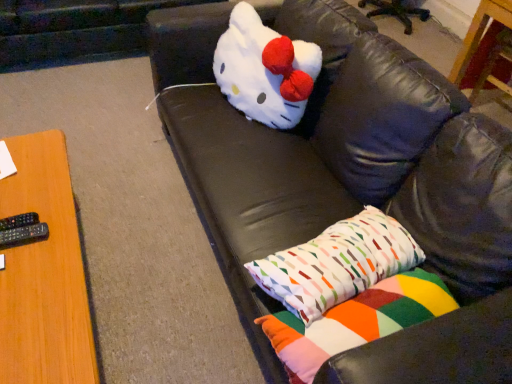
The image size is (512, 384). Identify the location of black plastic remote at left, which is counted as the first remote, starting from the top. pyautogui.click(x=19, y=221).

What do you see at coordinates (480, 33) in the screenshot?
I see `wooden table at upper right, acting as the second table starting from the left` at bounding box center [480, 33].

In order to click on geometric-patterned fabric pillow at lower right, placed as the 2th pillow when sorted from bottom to top in this screenshot , I will do `click(337, 264)`.

The height and width of the screenshot is (384, 512). What do you see at coordinates (265, 70) in the screenshot? I see `white plush toy at center` at bounding box center [265, 70].

The image size is (512, 384). What do you see at coordinates (364, 189) in the screenshot?
I see `black leather couch at upper center` at bounding box center [364, 189].

This screenshot has height=384, width=512. I want to click on wooden table at left, placed as the first table when sorted from left to right, so click(44, 273).

I want to click on black plastic remote at left, the 2th remote positioned from the top, so click(24, 235).

The width and height of the screenshot is (512, 384). Describe the element at coordinates (356, 321) in the screenshot. I see `multicolored fabric pillow at lower right, the second pillow when ordered from top to bottom` at that location.

I want to click on black plastic remote at left, which is counted as the first remote, starting from the top, so click(x=19, y=221).

Would you say geometric-patterned fabric pillow at lower right, which is the 1th pillow in top-to-bottom order, is outside wooden table at left, the 2th table viewed from the right?

That's correct, geometric-patterned fabric pillow at lower right, which is the 1th pillow in top-to-bottom order, is outside of wooden table at left, the 2th table viewed from the right.

From the image's perspective, is geometric-patterned fabric pillow at lower right, placed as the 2th pillow when sorted from bottom to top, positioned above or below wooden table at left, marked as the 1th table in a front-to-back arrangement?

Based on their image positions, geometric-patterned fabric pillow at lower right, placed as the 2th pillow when sorted from bottom to top, is located above wooden table at left, marked as the 1th table in a front-to-back arrangement.

From the picture: How distant is geometric-patterned fabric pillow at lower right, placed as the 2th pillow when sorted from bottom to top, from wooden table at left, placed as the first table when sorted from left to right?

geometric-patterned fabric pillow at lower right, placed as the 2th pillow when sorted from bottom to top, is 27.01 inches away from wooden table at left, placed as the first table when sorted from left to right.

Which is behind, point (403, 263) or point (58, 235)?

Point (58, 235)

Can you confirm if multicolored fabric pillow at lower right, the 1th pillow ordered from the bottom, is bigger than black leather couch at upper center?

Incorrect, multicolored fabric pillow at lower right, the 1th pillow ordered from the bottom, is not larger than black leather couch at upper center.

Is black leather couch at upper center inside multicolored fabric pillow at lower right, the 1th pillow ordered from the bottom?

No, black leather couch at upper center is located outside of multicolored fabric pillow at lower right, the 1th pillow ordered from the bottom.

Which point is more distant from viewer, [271,329] or [182,129]?

The point [182,129] is more distant.

Are multicolored fabric pillow at lower right, the second pillow when ordered from top to bottom, and black leather couch at upper center far apart?

Actually, multicolored fabric pillow at lower right, the second pillow when ordered from top to bottom, and black leather couch at upper center are a little close together.

From the image's perspective, is black plastic remote at left, the second remote positioned from the bottom, beneath black plastic remote at left, the 2th remote positioned from the top?

No, from the image's perspective, black plastic remote at left, the second remote positioned from the bottom, is not beneath black plastic remote at left, the 2th remote positioned from the top.

From a real-world perspective, does black plastic remote at left, which is counted as the first remote, starting from the top, sit lower than black plastic remote at left, placed as the 1th remote when sorted from bottom to top?

Indeed, from a real-world perspective, black plastic remote at left, which is counted as the first remote, starting from the top, is positioned beneath black plastic remote at left, placed as the 1th remote when sorted from bottom to top.

Which object is closer to the camera, black plastic remote at left, the second remote positioned from the bottom, or black plastic remote at left, placed as the 1th remote when sorted from bottom to top?

black plastic remote at left, placed as the 1th remote when sorted from bottom to top, is in front.

Considering the relative positions of black leather couch at upper center and black plastic remote at left, which is counted as the first remote, starting from the top, in the image provided, is black leather couch at upper center in front of black plastic remote at left, which is counted as the first remote, starting from the top,?

Yes, black leather couch at upper center is in front of black plastic remote at left, which is counted as the first remote, starting from the top.

Is black plastic remote at left, the second remote positioned from the bottom, surrounded by black leather couch at upper center?

Definitely not — black plastic remote at left, the second remote positioned from the bottom, is not inside black leather couch at upper center.

From the image's perspective, between black leather couch at upper center and black plastic remote at left, which is counted as the first remote, starting from the top, which one is located above?

black leather couch at upper center, from the image's perspective.

Is black leather couch at upper center next to black plastic remote at left, the second remote positioned from the bottom, and touching it?

No, black leather couch at upper center is not beside black plastic remote at left, the second remote positioned from the bottom.

Considering the points (470, 41) and (370, 324), which point is behind, point (470, 41) or point (370, 324)?

Positioned behind is point (470, 41).

Considering their positions, is wooden table at upper right, which appears as the second table when ordered from the bottom, located in front of or behind multicolored fabric pillow at lower right, the second pillow when ordered from top to bottom?

wooden table at upper right, which appears as the second table when ordered from the bottom, is positioned farther from the viewer than multicolored fabric pillow at lower right, the second pillow when ordered from top to bottom.

Measure the distance from wooden table at upper right, which appears as the first table when viewed from the back, to multicolored fabric pillow at lower right, the second pillow when ordered from top to bottom.

wooden table at upper right, which appears as the first table when viewed from the back, is 1.69 meters from multicolored fabric pillow at lower right, the second pillow when ordered from top to bottom.

Does black plastic remote at left, placed as the 1th remote when sorted from bottom to top, have a greater width compared to black leather couch at upper center?

No, black plastic remote at left, placed as the 1th remote when sorted from bottom to top, is not wider than black leather couch at upper center.

Is black plastic remote at left, the 2th remote positioned from the top, at the left side of black leather couch at upper center?

Yes.

Is black plastic remote at left, the 2th remote positioned from the top, directly adjacent to black leather couch at upper center?

black plastic remote at left, the 2th remote positioned from the top, is not next to black leather couch at upper center, and they're not touching.

How different are the orientations of black plastic remote at left, the 2th remote positioned from the top, and black leather couch at upper center in degrees?

179 degrees.

Does white plush toy at center come in front of wooden table at upper right, acting as the second table starting from the left?

Yes, it is in front of wooden table at upper right, acting as the second table starting from the left.

From the picture: Can you confirm if white plush toy at center is bigger than wooden table at upper right, acting as the first table starting from the right?

No.

Based on the photo, from the image's perspective, is white plush toy at center above wooden table at upper right, which appears as the second table when viewed from the front?

Incorrect, from the image's perspective, white plush toy at center is lower than wooden table at upper right, which appears as the second table when viewed from the front.

Is white plush toy at center taller than wooden table at upper right, which appears as the first table when viewed from the back?

Incorrect, the height of white plush toy at center is not larger of that of wooden table at upper right, which appears as the first table when viewed from the back.

I want to click on pillow above the wooden table at left, marked as the 2th table in a back-to-front arrangement (from the image's perspective), so click(x=337, y=264).

Where is `the 2nd pillow to the right when counting from the black leather couch at upper center`? This screenshot has height=384, width=512. the 2nd pillow to the right when counting from the black leather couch at upper center is located at coordinates (356, 321).

Based on their spatial positions, is white plush toy at center or geometric-patterned fabric pillow at lower right, which is the 1th pillow in top-to-bottom order, further from wooden table at left, placed as the first table when sorted from left to right?

white plush toy at center.

Estimate the real-world distances between objects in this image. Which object is closer to black leather couch at upper center, black plastic remote at left, placed as the 1th remote when sorted from bottom to top, or white plush toy at center?

white plush toy at center lies closer to black leather couch at upper center than the other object.

From the image, which object appears to be farther from black leather couch at upper center, white plush toy at center or black plastic remote at left, the second remote positioned from the bottom?

black plastic remote at left, the second remote positioned from the bottom.

Estimate the real-world distances between objects in this image. Which object is closer to white plush toy at center, black plastic remote at left, which is counted as the first remote, starting from the top, or black leather couch at upper center?

black leather couch at upper center is positioned closer to the anchor white plush toy at center.

From the image, which object appears to be farther from wooden table at left, placed as the second table when sorted from top to bottom, black plastic remote at left, placed as the 1th remote when sorted from bottom to top, or wooden table at upper right, which is the first table in top-to-bottom order?

wooden table at upper right, which is the first table in top-to-bottom order, lies further to wooden table at left, placed as the second table when sorted from top to bottom, than the other object.

Based on their spatial positions, is wooden table at left, the 2th table viewed from the right, or black leather couch at upper center further from wooden table at upper right, which appears as the first table when viewed from the back?

wooden table at left, the 2th table viewed from the right.

Based on their spatial positions, is black plastic remote at left, placed as the 1th remote when sorted from bottom to top, or multicolored fabric pillow at lower right, the 1th pillow ordered from the bottom, further from white plush toy at center?

Among the two, black plastic remote at left, placed as the 1th remote when sorted from bottom to top, is located further to white plush toy at center.

Looking at this image, from the image, which object appears to be farther from black leather couch at upper center, white plush toy at center or black plastic remote at left, the 2th remote positioned from the top?

Based on the image, black plastic remote at left, the 2th remote positioned from the top, appears to be further to black leather couch at upper center.

Where is `studio couch between black plastic remote at left, the 2th remote positioned from the top, and wooden table at upper right, acting as the first table starting from the right`? This screenshot has height=384, width=512. studio couch between black plastic remote at left, the 2th remote positioned from the top, and wooden table at upper right, acting as the first table starting from the right is located at coordinates (364, 189).

I want to click on toy situated between black plastic remote at left, the 2th remote positioned from the top, and geometric-patterned fabric pillow at lower right, which is the 1th pillow in top-to-bottom order, from left to right, so click(x=265, y=70).

Image resolution: width=512 pixels, height=384 pixels. I want to click on remote situated between wooden table at left, marked as the 1th table in a front-to-back arrangement, and wooden table at upper right, which appears as the first table when viewed from the back, from left to right, so click(x=24, y=235).

Find the location of a particular element. This screenshot has height=384, width=512. toy between black plastic remote at left, the second remote positioned from the bottom, and multicolored fabric pillow at lower right, the 1th pillow ordered from the bottom, in the horizontal direction is located at coordinates coord(265,70).